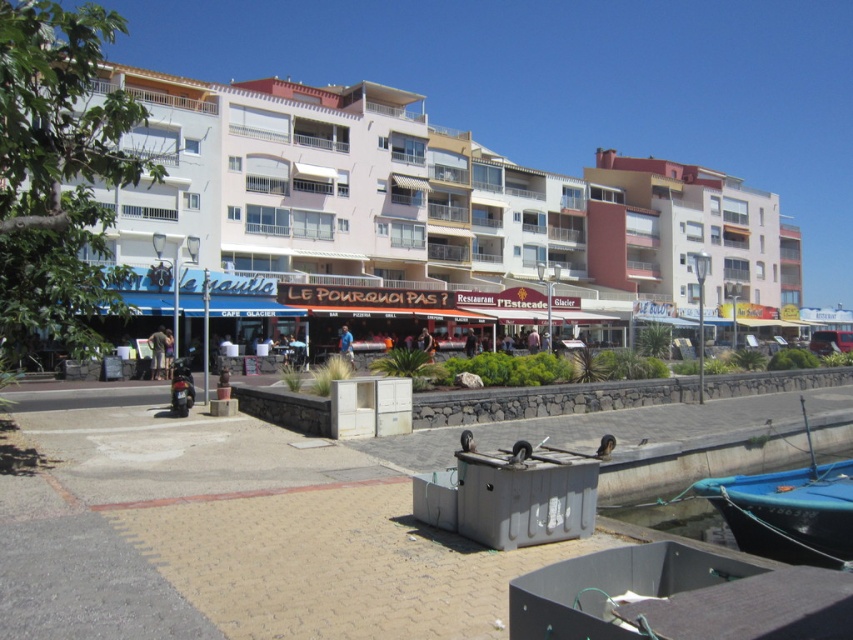
You are standing on the waterfront walkway and see both the light brown leather jacket at center and the blue fabric shirt at center. If you want to pick up both items, which one should you move towards first if you are currently facing the water?

The light brown leather jacket at center is 10.34 meters away from the blue fabric shirt at center. Since you are facing the water, you would need to determine which item is closer to your current position. However, the distance between the two items is provided, but their individual distances from your position aren

You are a tourist standing on the walkway and want to take a photo of the teal glossy boat at lower right and the light brown leather jacket at center. To frame both in your camera, should you adjust your camera to the left or right?

The teal glossy boat at lower right is to the right of the light brown leather jacket at center, so you should adjust your camera to the right to include both objects in the frame.